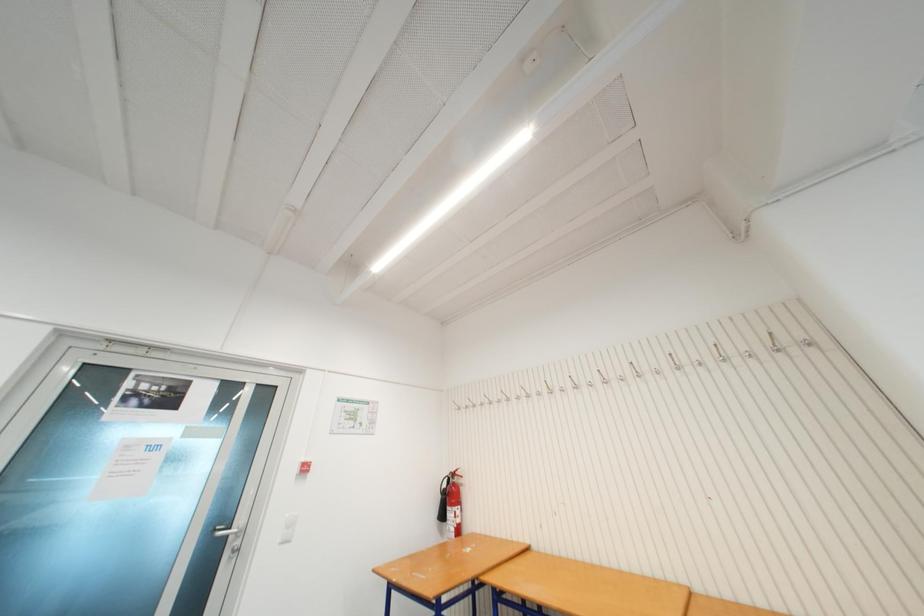
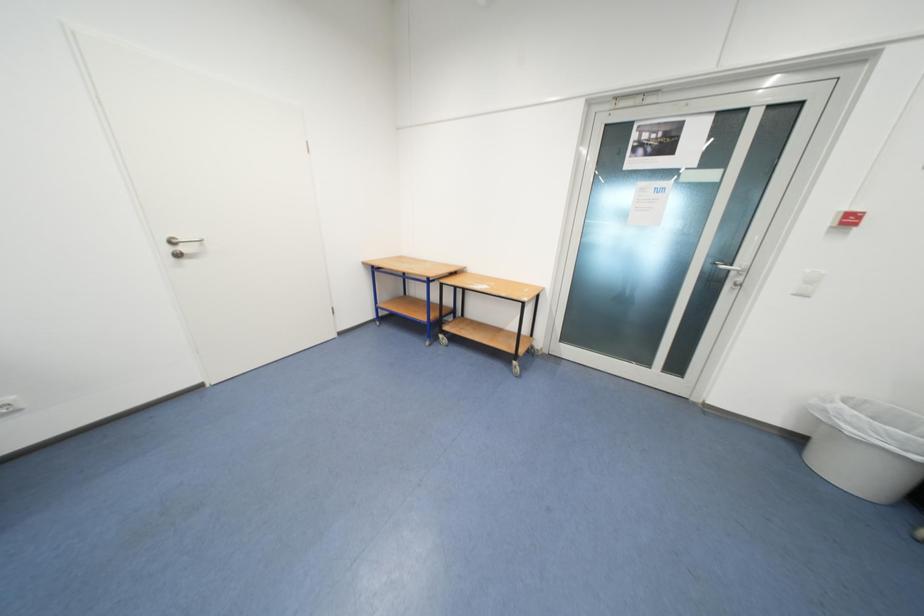
Looking at this image, how did the camera likely rotate?

The camera rotated toward left-down.